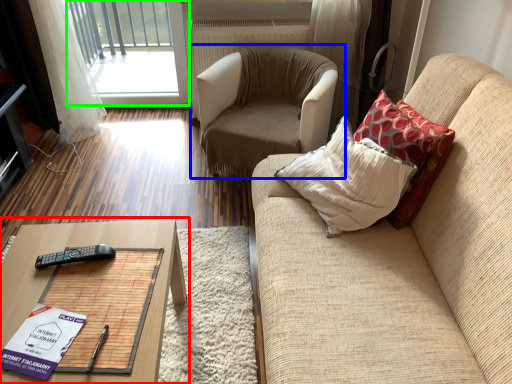
Question: Which object is the closest to the table (highlighted by a red box)? Choose among these: chair (highlighted by a blue box) or window (highlighted by a green box).

Choices:
 (A) chair
 (B) window

Answer: (A)